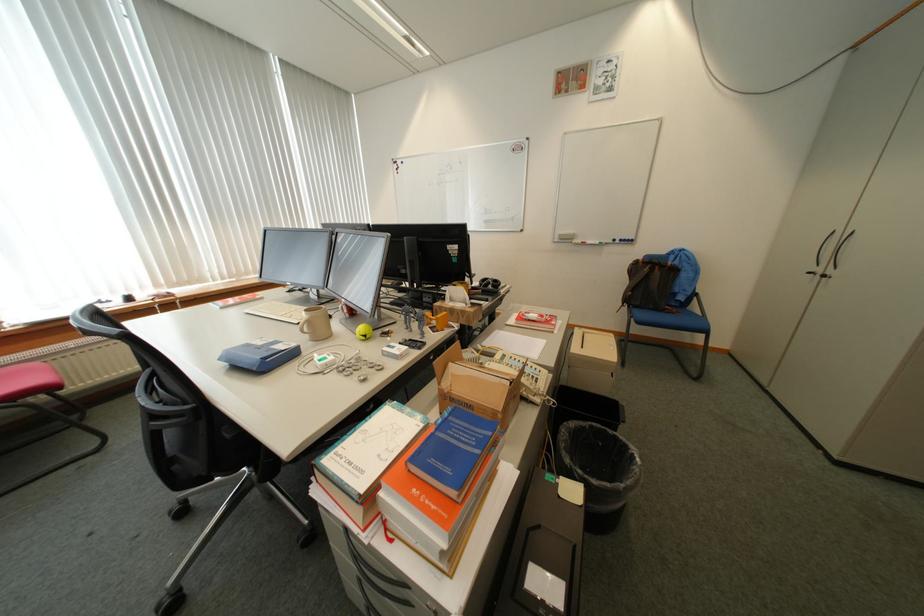
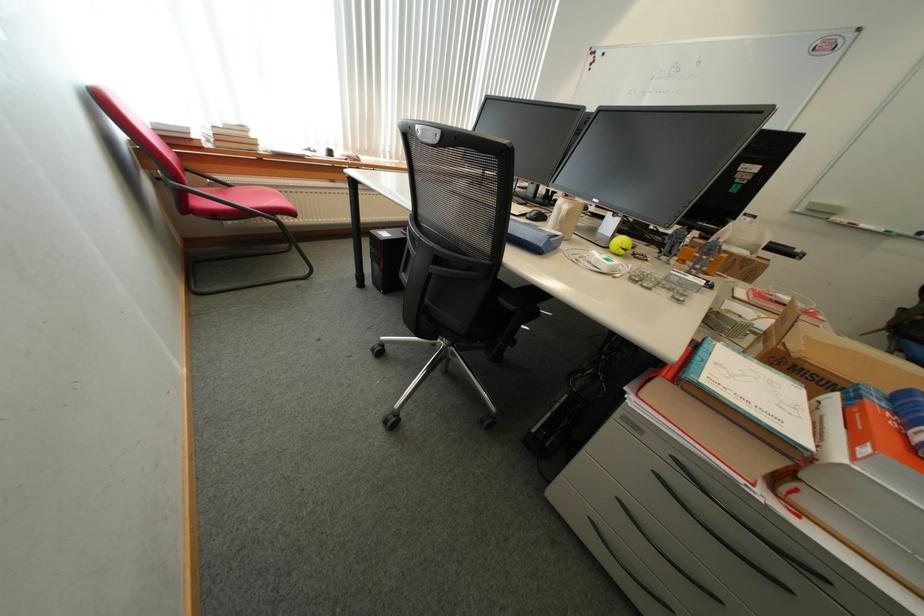
Question: How did the camera likely rotate?

Choices:
 (A) Left
 (B) Right
 (C) Up
 (D) Down

Answer: (D)